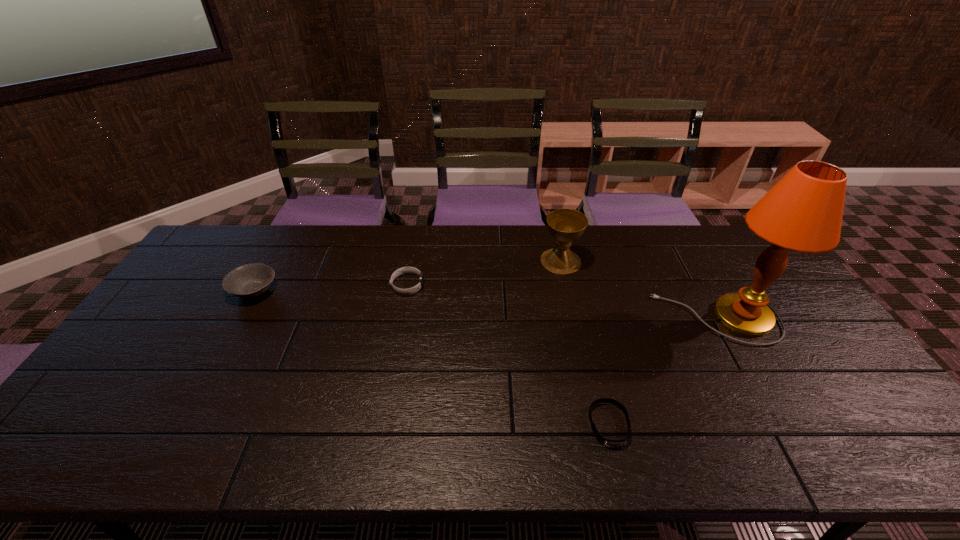
Identify the location of free space between the nearest object and the fourth shortest object. (585, 343).

Locate an element on the screen. The height and width of the screenshot is (540, 960). free space between the taller wristband and the bowl is located at coordinates pyautogui.click(x=331, y=288).

Image resolution: width=960 pixels, height=540 pixels. Find the location of `blank region between the fourth shortest object and the third tallest object`. blank region between the fourth shortest object and the third tallest object is located at coordinates (407, 276).

At what (x,y) coordinates should I click in order to perform the action: click on blank region between the chalice and the nearer wristband. Please return your answer as a coordinate pair (x, y). Looking at the image, I should click on (585, 343).

Find the location of a particular element. The width and height of the screenshot is (960, 540). free space between the right wristband and the tallest object is located at coordinates (x=663, y=372).

Locate an element on the screen. vacant area that lies between the taller wristband and the chalice is located at coordinates (484, 273).

In order to click on free spot between the second tallest object and the lamp in this screenshot , I will do `click(639, 289)`.

Where is `unoccupied area between the bowl and the tallest object`? Image resolution: width=960 pixels, height=540 pixels. unoccupied area between the bowl and the tallest object is located at coordinates (487, 305).

Where is `free space between the bowl and the taller wristband`? The image size is (960, 540). free space between the bowl and the taller wristband is located at coordinates pos(331,288).

The width and height of the screenshot is (960, 540). I want to click on free space between the nearest object and the taller wristband, so click(508, 355).